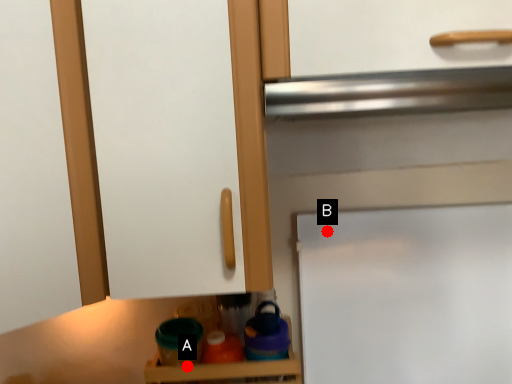
Question: Two points are circled on the image, labeled by A and B beside each circle. Which of the following is the closest to the observer?

Choices:
 (A) A is closer
 (B) B is closer

Answer: (A)